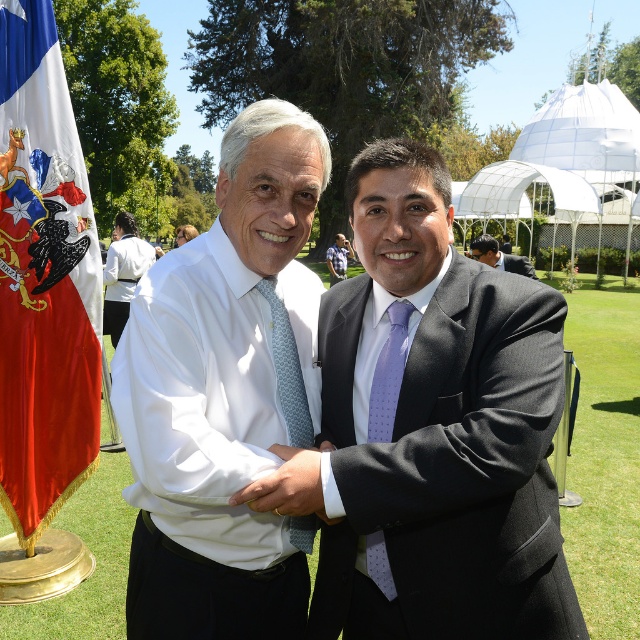
Question: Which object appears closest to the camera in this image?

Choices:
 (A) lavender dotted silk tie at center
 (B) white shirt at center
 (C) matte black suit at center

Answer: (C)

Question: Is matte black suit at center to the right of white shirt at center from the viewer's perspective?

Choices:
 (A) yes
 (B) no

Answer: (A)

Question: Which point appears farthest from the camera in this image?

Choices:
 (A) (77, 285)
 (B) (276, 326)
 (C) (340, 256)

Answer: (C)

Question: Can you confirm if light blue textured tie at center is positioned above purple satin suit at center?

Choices:
 (A) no
 (B) yes

Answer: (A)

Question: Can you confirm if matte black suit at center is bigger than lavender dotted silk tie at center?

Choices:
 (A) yes
 (B) no

Answer: (A)

Question: Considering the real-world distances, which object is farthest from the white shirt at center?

Choices:
 (A) light blue textured tie at center
 (B) purple satin suit at center
 (C) white matte shirt at center

Answer: (A)